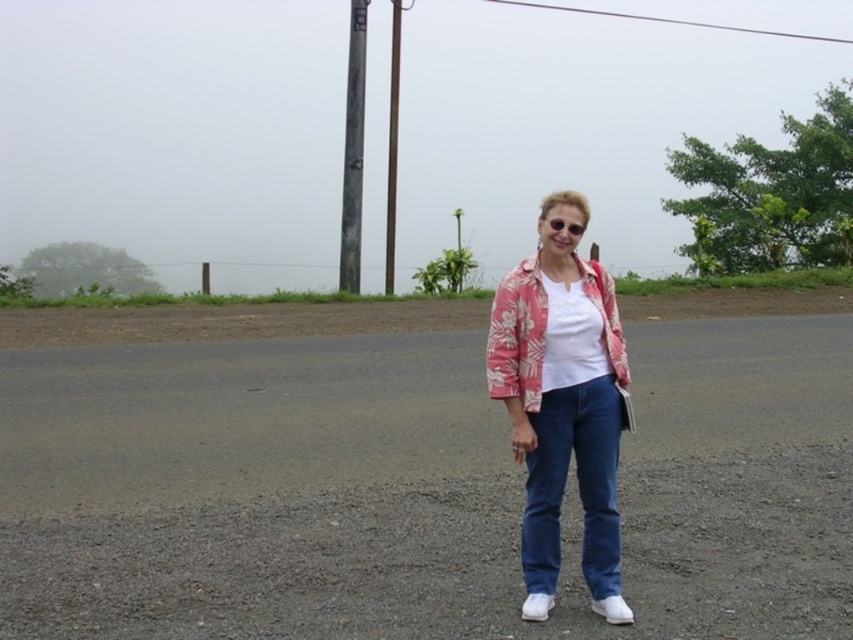
You are a photographer trying to capture the entire scene in one shot. Given that the floral pink fabric jacket at center and the weathered wood pole at upper center are both in your frame, which object will appear smaller in the photo?

The floral pink fabric jacket at center will appear smaller in the photo because it occupies less space than the weathered wood pole at upper center.